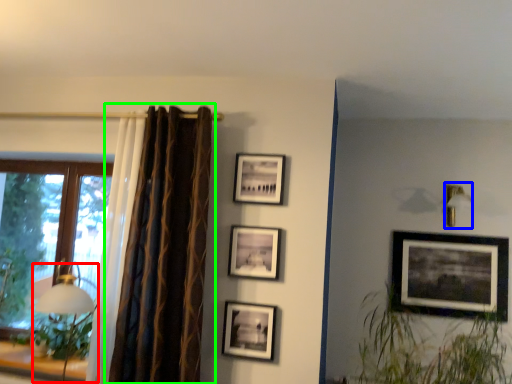
Question: Estimate the real-world distances between objects in this image. Which object is closer to table lamp (highlighted by a red box), lamp (highlighted by a blue box) or curtain (highlighted by a green box)?

Choices:
 (A) lamp
 (B) curtain

Answer: (B)